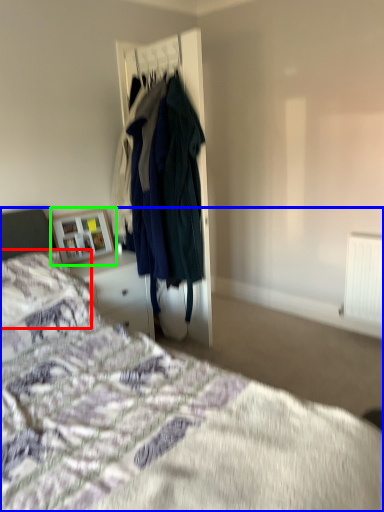
Question: Considering the real-world distances, which object is closest to pillow (highlighted by a red box)? bed (highlighted by a blue box) or picture frame (highlighted by a green box).

Choices:
 (A) bed
 (B) picture frame

Answer: (A)